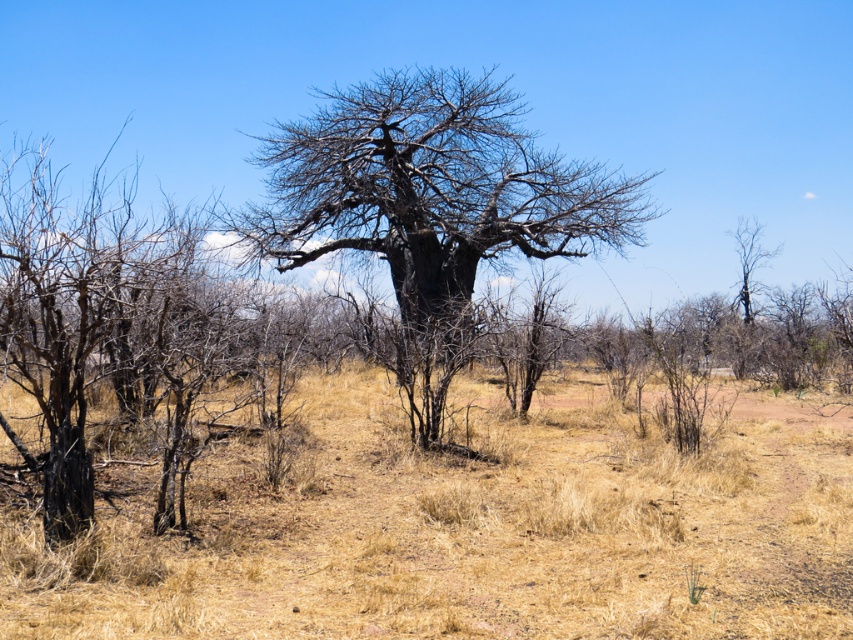
You are a hiker who has lost your way in this desert landscape. You see the dry grass at center. Based on its position, can you estimate its exact coordinates in the image?

The dry grass at center is located at coordinates point [465,528] in the image.